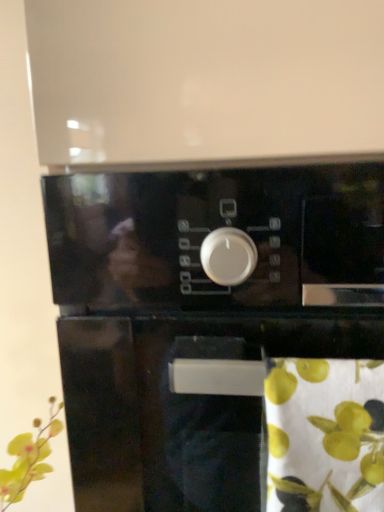
Question: From the image's perspective, is black glossy oven at center above or below green fabric at lower right?

Choices:
 (A) below
 (B) above

Answer: (B)

Question: Is black glossy oven at center inside or outside of green fabric at lower right?

Choices:
 (A) inside
 (B) outside

Answer: (B)

Question: From a real-world perspective, relative to green fabric at lower right, is black glossy oven at center vertically above or below?

Choices:
 (A) below
 (B) above

Answer: (A)

Question: Considering their positions, is green fabric at lower right located in front of or behind black glossy oven at center?

Choices:
 (A) behind
 (B) front

Answer: (B)

Question: From a real-world perspective, is green fabric at lower right positioned above or below black glossy oven at center?

Choices:
 (A) below
 (B) above

Answer: (B)

Question: Do you think green fabric at lower right is within black glossy oven at center, or outside of it?

Choices:
 (A) inside
 (B) outside

Answer: (A)

Question: Does point (334, 424) appear closer or farther from the camera than point (162, 508)?

Choices:
 (A) closer
 (B) farther

Answer: (A)